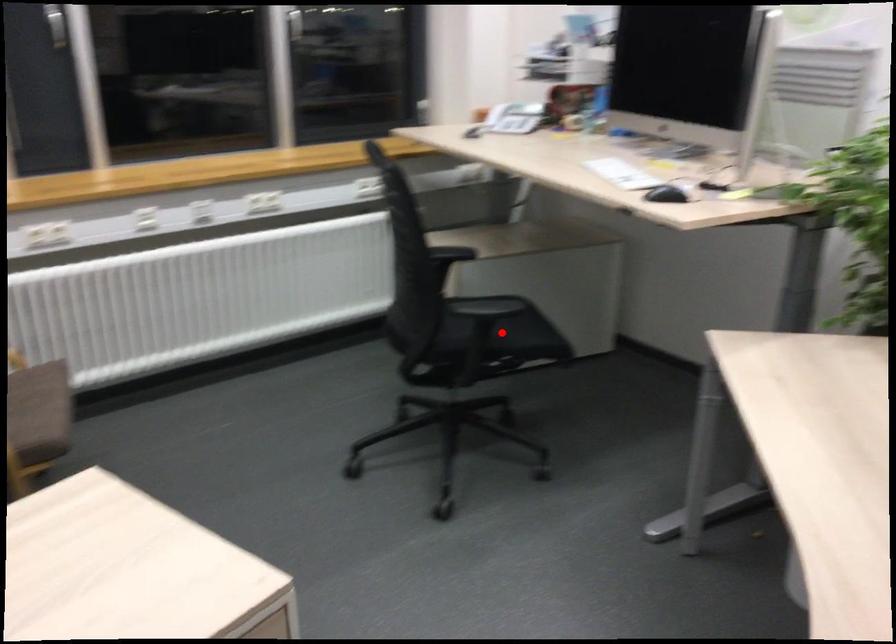
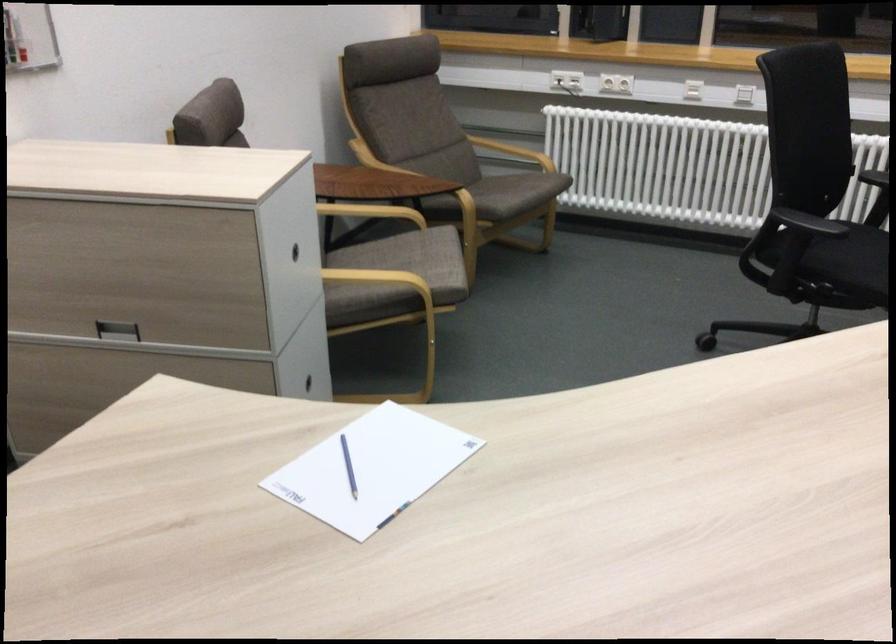
Locate, in the second image, the point that corresponds to the highlighted location in the first image.

(849, 267)